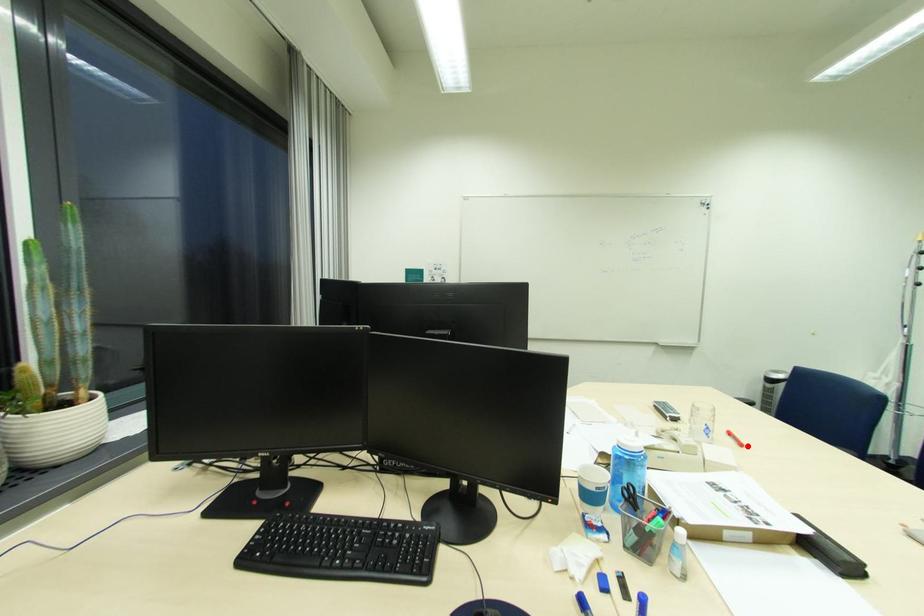
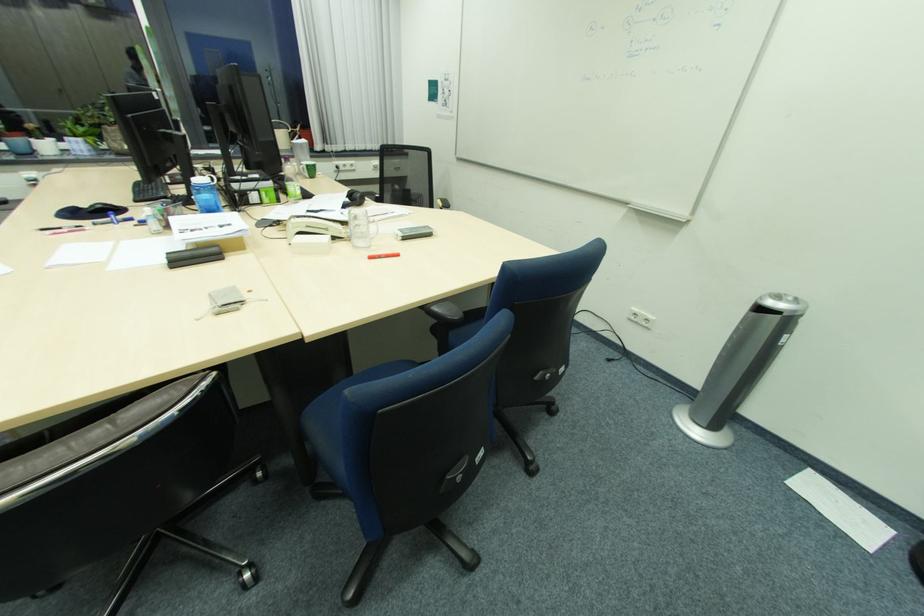
The point at the highlighted location is marked in the first image. Where is the corresponding point in the second image?

(377, 257)